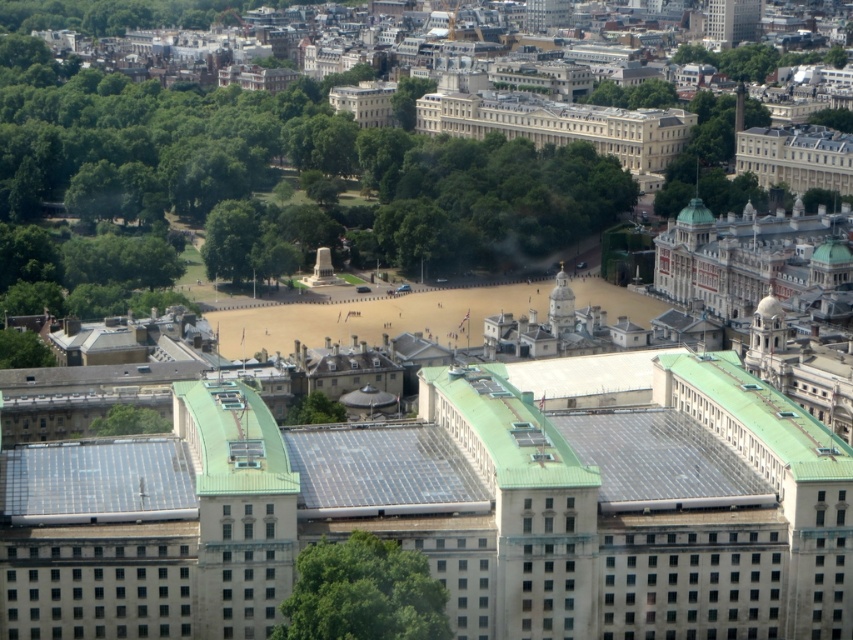
Question: Can you confirm if transparent solar panels at center is positioned above green metallic roof at center-right?

Choices:
 (A) yes
 (B) no

Answer: (B)

Question: Which object appears closest to the camera in this image?

Choices:
 (A) transparent solar panels at center
 (B) green metallic roof at center-right

Answer: (A)

Question: Can you confirm if transparent solar panels at center is positioned to the right of green metallic roof at center-right?

Choices:
 (A) no
 (B) yes

Answer: (A)

Question: Does transparent solar panels at center have a smaller size compared to green metallic roof at center-right?

Choices:
 (A) yes
 (B) no

Answer: (A)